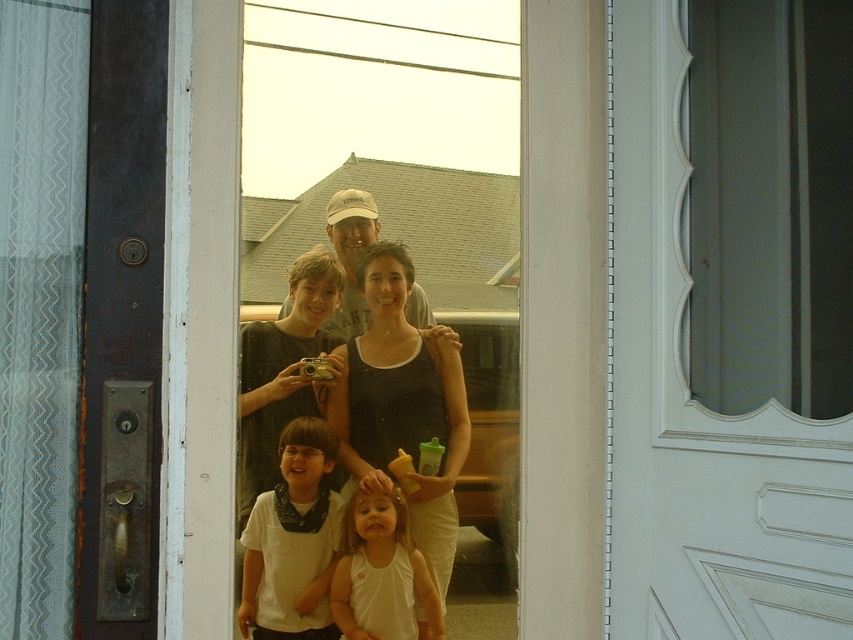
You are trying to determine if the transparent glass door at center can fit through a doorway that is the same width as the matte white tank top at center. Based on their widths, will the door fit?

The transparent glass door at center is wider than the matte white tank top at center, so it will not fit through a doorway of the same width as the matte white tank top at center.

You are standing outside the house looking at the door. The transparent glass door at center has a point at coordinates (357, 209). If you were to draw a line from your eye level to this point, would it pass through the glass pane or the wooden section of the door?

The point at coordinates (357, 209) indicates the transparent glass door at center, so drawing a line from your eye level to this point would pass through the glass pane of the door.